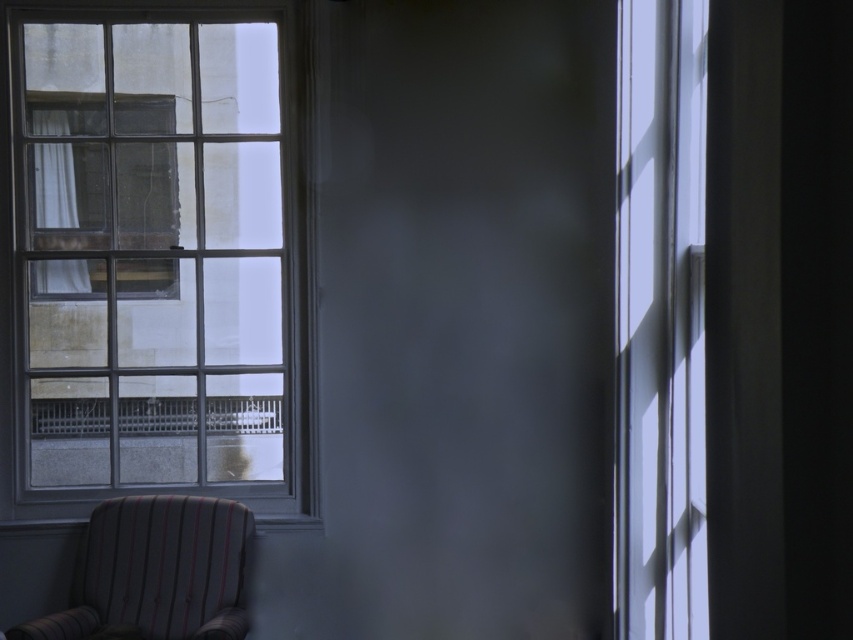
You are sitting in the striped fabric armchair at lower left and want to look outside through the transparent glass window at right. Can you see the window clearly from your current position?

The transparent glass window at right is above the striped fabric armchair at lower left, so you can see the window clearly from your current position as it is positioned above you.

You are sitting in the striped fabric armchair at lower left and want to look out the transparent glass window at right. Can you see the entire window from your current position?

The transparent glass window at right is taller than striped fabric armchair at lower left, so yes, you can see the entire window from your current position in the striped fabric armchair at lower left.